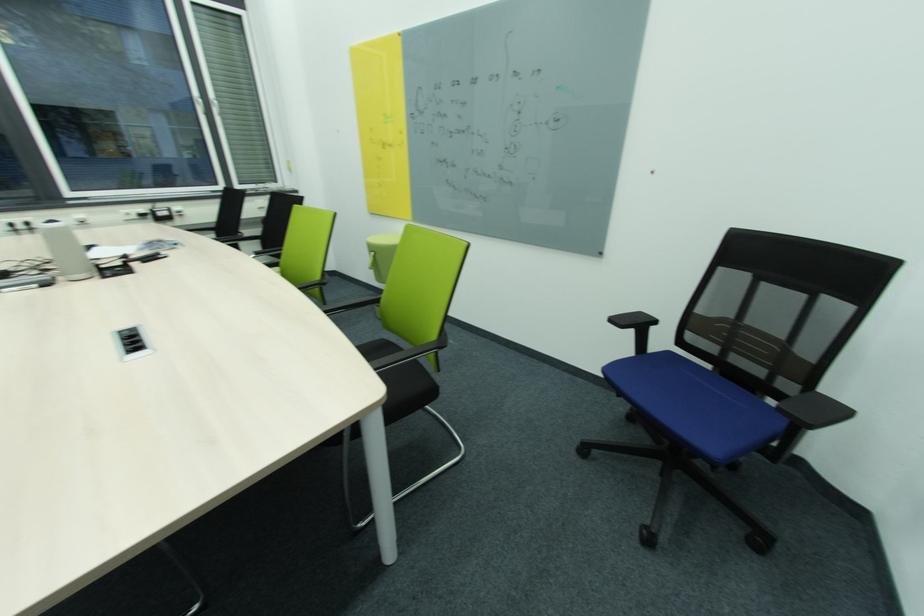
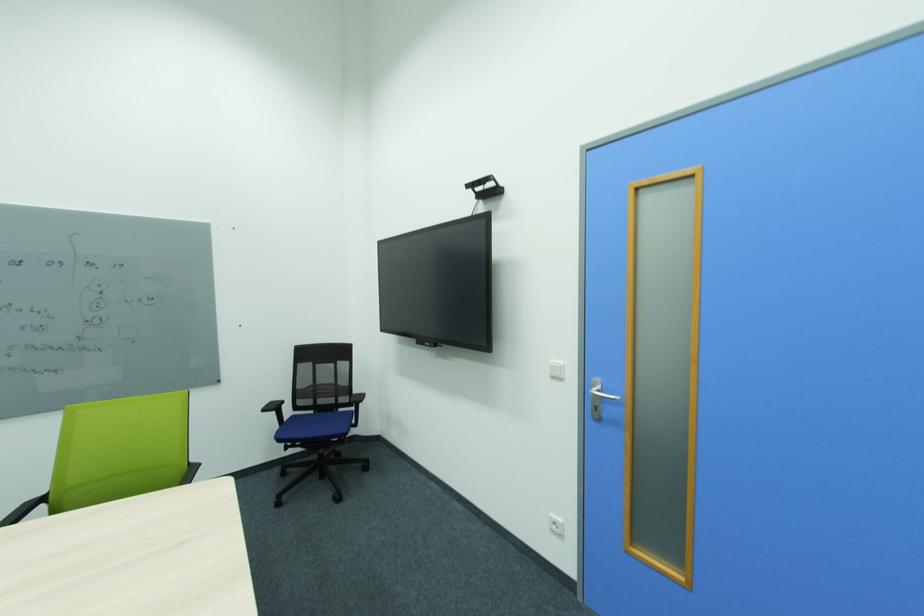
Where in the second image is the point corresponding to the point at 617,321 from the first image?

(270, 411)